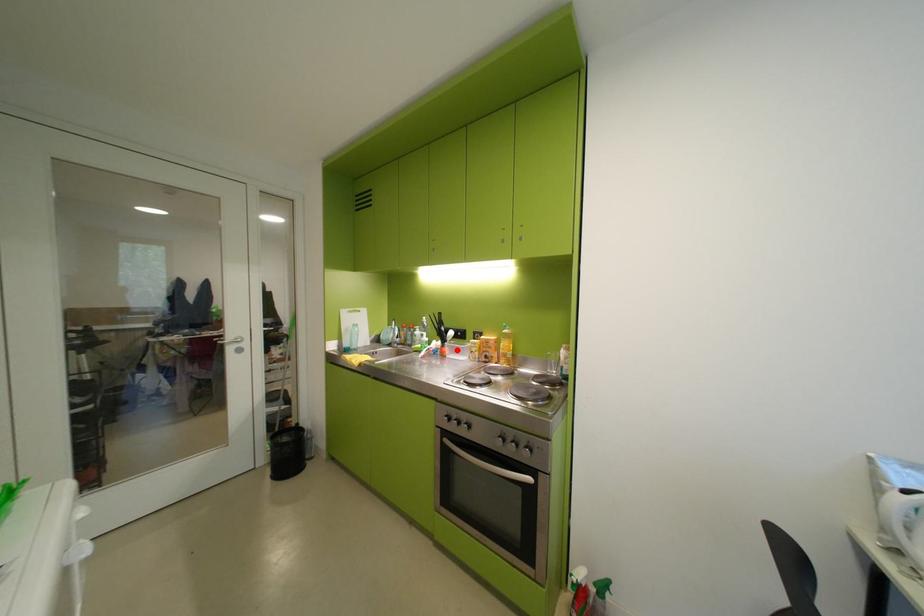
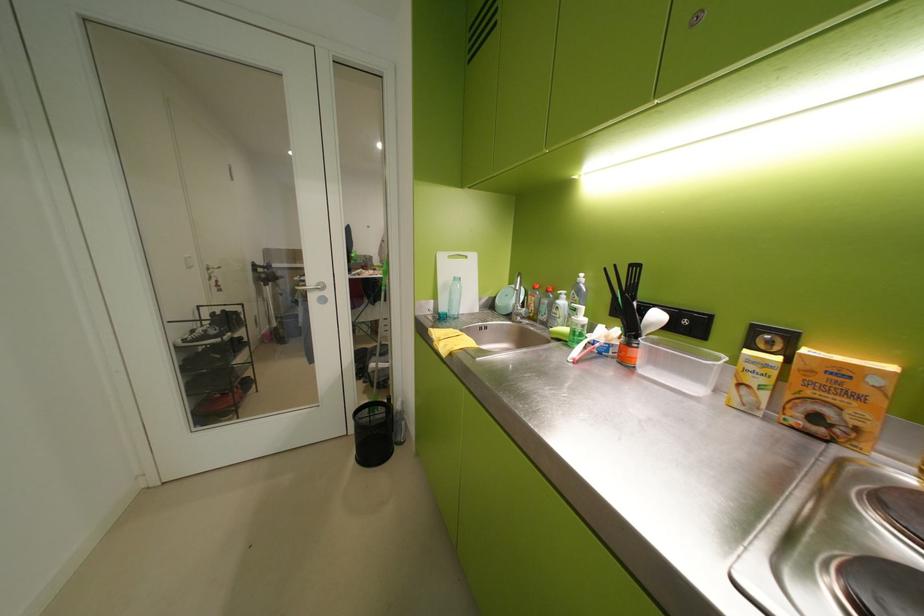
Locate, in the second image, the point that corresponds to the highlighted location in the first image.

(650, 354)